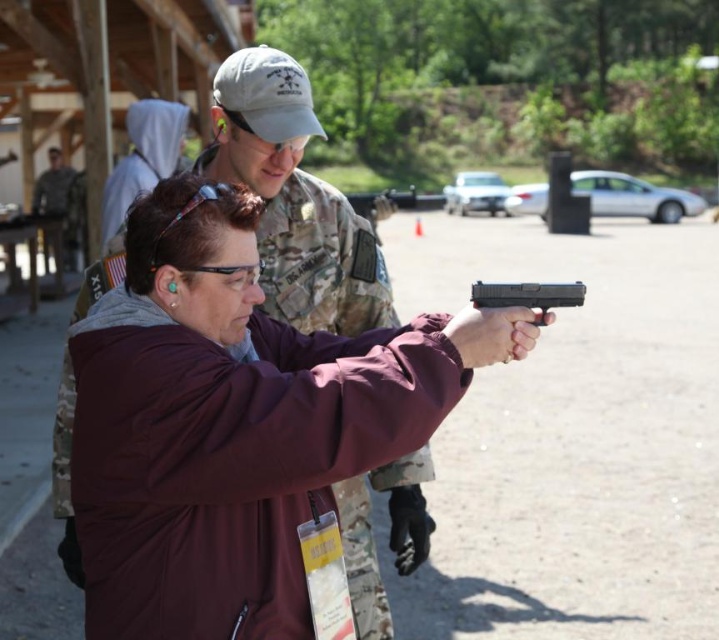
Is point (470, 289) behind point (45, 204)?

That is False.

Is black plastic handgun at center above camouflage uniform at center?

Actually, black plastic handgun at center is below camouflage uniform at center.

Which is in front, point (563, 300) or point (65, 172)?

Point (563, 300) is in front.

Locate an element on the screen. black plastic handgun at center is located at coordinates (526, 296).

Who is lower down, maroon fabric jacket at center or black plastic handgun at center?

maroon fabric jacket at center is below.

Between point (141, 269) and point (521, 289), which one is positioned behind?

The point (521, 289) is behind.

The width and height of the screenshot is (719, 640). I want to click on maroon fabric jacket at center, so click(x=234, y=422).

How much distance is there between maroon fabric jacket at center and camouflage uniform at center?

maroon fabric jacket at center and camouflage uniform at center are 13.27 meters apart.

Is point (170, 289) less distant than point (45, 193)?

Yes, it is.

Locate an element on the screen. The width and height of the screenshot is (719, 640). maroon fabric jacket at center is located at coordinates (234, 422).